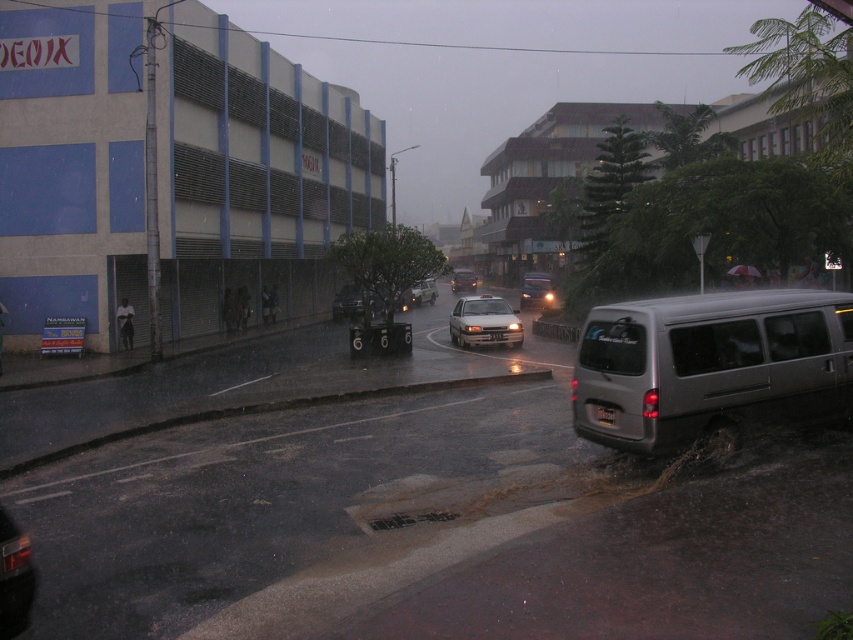
Question: Which point appears farthest from the camera in this image?

Choices:
 (A) (524, 282)
 (B) (691, 346)
 (C) (509, 316)
 (D) (463, 276)

Answer: (D)

Question: Can you confirm if satin silver van at lower right is positioned to the left of shiny silver sedan at center?

Choices:
 (A) no
 (B) yes

Answer: (B)

Question: Which of the following is the closest to the observer?

Choices:
 (A) (666, 403)
 (B) (341, 304)
 (C) (474, 280)

Answer: (A)

Question: Among these objects, which one is farthest from the camera?

Choices:
 (A) shiny silver sedan at center
 (B) metallic silver van at center
 (C) satin silver van at lower right
 (D) white glossy sedan at center

Answer: (D)

Question: Can you confirm if satin silver van at lower right is positioned below white matte sedan at center?

Choices:
 (A) no
 (B) yes

Answer: (B)

Question: Can you confirm if white matte sedan at center is positioned to the left of white glossy taxi at center?

Choices:
 (A) yes
 (B) no

Answer: (B)